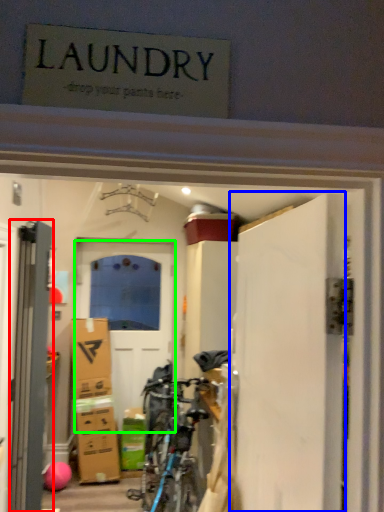
Question: Which object is the farthest from door (highlighted by a red box)? Choose among these: door (highlighted by a blue box) or door (highlighted by a green box).

Choices:
 (A) door
 (B) door

Answer: (B)